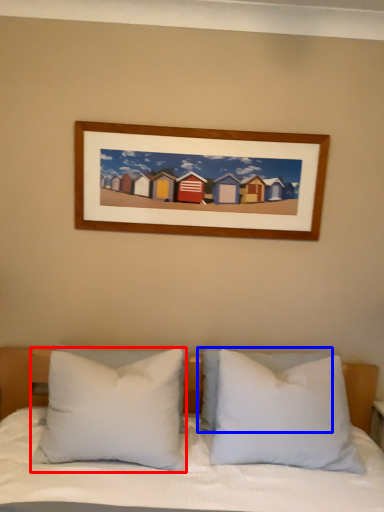
Question: Which of the following is the farthest to the observer, pillow (highlighted by a red box) or pillow (highlighted by a blue box)?

Choices:
 (A) pillow
 (B) pillow

Answer: (B)